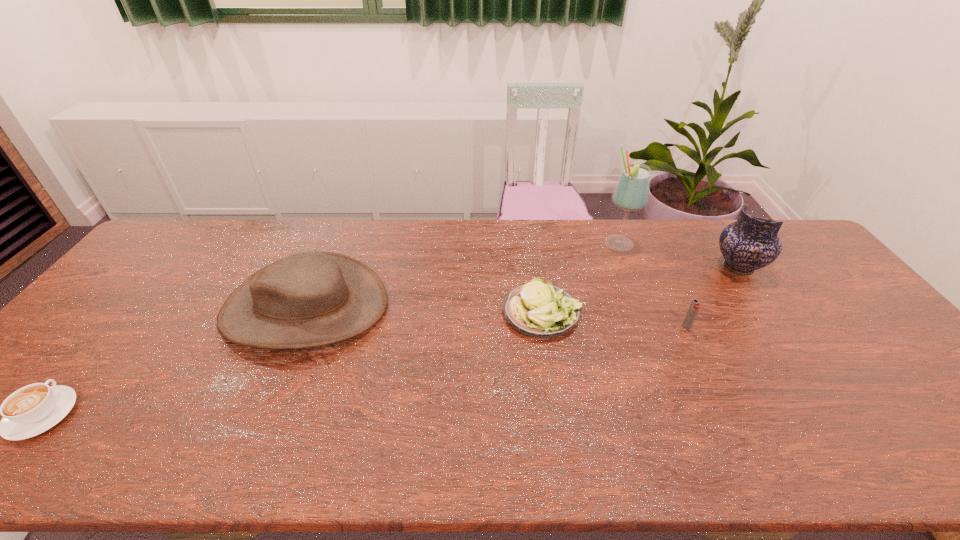
Image resolution: width=960 pixels, height=540 pixels. I want to click on free area in between the fourth object from left to right and the rightmost object, so click(x=679, y=255).

This screenshot has width=960, height=540. Identify the location of vacant space in between the second tallest object and the alcohol. (679, 255).

Where is `free space that is in between the third object from right to left and the fourth tallest object`? Image resolution: width=960 pixels, height=540 pixels. free space that is in between the third object from right to left and the fourth tallest object is located at coordinates (653, 286).

Where is `free area in between the third shortest object and the pottery`? The image size is (960, 540). free area in between the third shortest object and the pottery is located at coordinates (712, 297).

Locate an element on the screen. The width and height of the screenshot is (960, 540). vacant region between the third object from left to right and the tallest object is located at coordinates (580, 279).

Locate an element on the screen. Image resolution: width=960 pixels, height=540 pixels. vacant space that's between the alcohol and the third shortest object is located at coordinates (x=653, y=286).

At what (x,y) coordinates should I click in order to perform the action: click on empty space that is in between the third object from right to left and the second shortest object. Please return your answer as a coordinate pair (x, y). Looking at the image, I should click on (580, 279).

I want to click on object that is the closest one to the fifth object from left to right, so click(750, 243).

Where is `object that stands as the fifth closest to the third object from right to left`? This screenshot has height=540, width=960. object that stands as the fifth closest to the third object from right to left is located at coordinates (31, 410).

This screenshot has width=960, height=540. In order to click on free space that satisfies the following two spatial constraints: 1. on the back side of the cowboy hat; 2. on the right side of the rightmost object in this screenshot , I will do `click(323, 267)`.